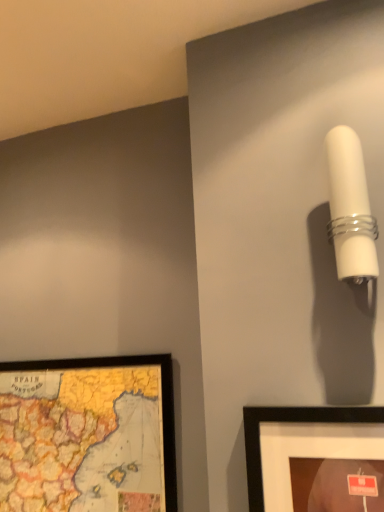
The width and height of the screenshot is (384, 512). Describe the element at coordinates (88, 435) in the screenshot. I see `wooden map at lower left` at that location.

This screenshot has width=384, height=512. Identify the location of wooden map at lower left. (88, 435).

The width and height of the screenshot is (384, 512). What do you see at coordinates (350, 209) in the screenshot?
I see `white glossy wall sconce at upper right` at bounding box center [350, 209].

Where is `white glossy wall sconce at upper right`? The width and height of the screenshot is (384, 512). white glossy wall sconce at upper right is located at coordinates (350, 209).

Find the location of a particular element. wooden map at lower left is located at coordinates (88, 435).

Consider the image. Which is more to the right, white glossy wall sconce at upper right or wooden map at lower left?

Positioned to the right is white glossy wall sconce at upper right.

Which is in front, white glossy wall sconce at upper right or wooden map at lower left?

white glossy wall sconce at upper right.

Which is in front, point (360, 173) or point (84, 384)?

Point (360, 173)

Consider the image. From the image's perspective, between white glossy wall sconce at upper right and wooden map at lower left, which one is located above?

white glossy wall sconce at upper right, from the image's perspective.

From a real-world perspective, does white glossy wall sconce at upper right sit lower than wooden map at lower left?

Incorrect, from a real-world perspective, white glossy wall sconce at upper right is higher than wooden map at lower left.

Which object is thinner, white glossy wall sconce at upper right or wooden map at lower left?

wooden map at lower left is thinner.

Considering the sizes of objects white glossy wall sconce at upper right and wooden map at lower left in the image provided, who is shorter, white glossy wall sconce at upper right or wooden map at lower left?

Standing shorter between the two is white glossy wall sconce at upper right.

Which of these two, white glossy wall sconce at upper right or wooden map at lower left, is bigger?

Bigger between the two is wooden map at lower left.

Is white glossy wall sconce at upper right completely or partially outside of wooden map at lower left?

Indeed, white glossy wall sconce at upper right is completely outside wooden map at lower left.

Is white glossy wall sconce at upper right with wooden map at lower left?

They are not placed beside each other.

Is white glossy wall sconce at upper right oriented towards wooden map at lower left?

No, white glossy wall sconce at upper right does not turn towards wooden map at lower left.

Identify the location of lamp in front of the wooden map at lower left. This screenshot has height=512, width=384. (350, 209).

In the image, is wooden map at lower left on the left side or the right side of white glossy wall sconce at upper right?

In the image, wooden map at lower left appears on the left side of white glossy wall sconce at upper right.

From the picture: Is wooden map at lower left behind white glossy wall sconce at upper right?

Yes, it is.

Is point (52, 415) in front of point (349, 222)?

No, it is not.

From the image's perspective, which is below, wooden map at lower left or white glossy wall sconce at upper right?

wooden map at lower left.

Looking at this image, from a real-world perspective, is wooden map at lower left positioned under white glossy wall sconce at upper right based on gravity?

Yes, from a real-world perspective, wooden map at lower left is beneath white glossy wall sconce at upper right.

Does wooden map at lower left have a greater width compared to white glossy wall sconce at upper right?

No.

Is wooden map at lower left taller than white glossy wall sconce at upper right?

Yes.

In the scene shown: Is wooden map at lower left bigger than white glossy wall sconce at upper right?

Correct, wooden map at lower left is larger in size than white glossy wall sconce at upper right.

Is wooden map at lower left outside of white glossy wall sconce at upper right?

Yes, wooden map at lower left is located beyond the bounds of white glossy wall sconce at upper right.

Is wooden map at lower left far from white glossy wall sconce at upper right?

That's not correct — wooden map at lower left is a little close to white glossy wall sconce at upper right.

Consider the image. Is wooden map at lower left aimed at white glossy wall sconce at upper right?

No.

Find the location of a particular element. lamp above the wooden map at lower left (from the image's perspective) is located at coordinates (350, 209).

This screenshot has width=384, height=512. In order to click on lamp above the wooden map at lower left (from the image's perspective) in this screenshot , I will do `click(350, 209)`.

Locate an element on the screen. lamp in front of the wooden map at lower left is located at coordinates (350, 209).